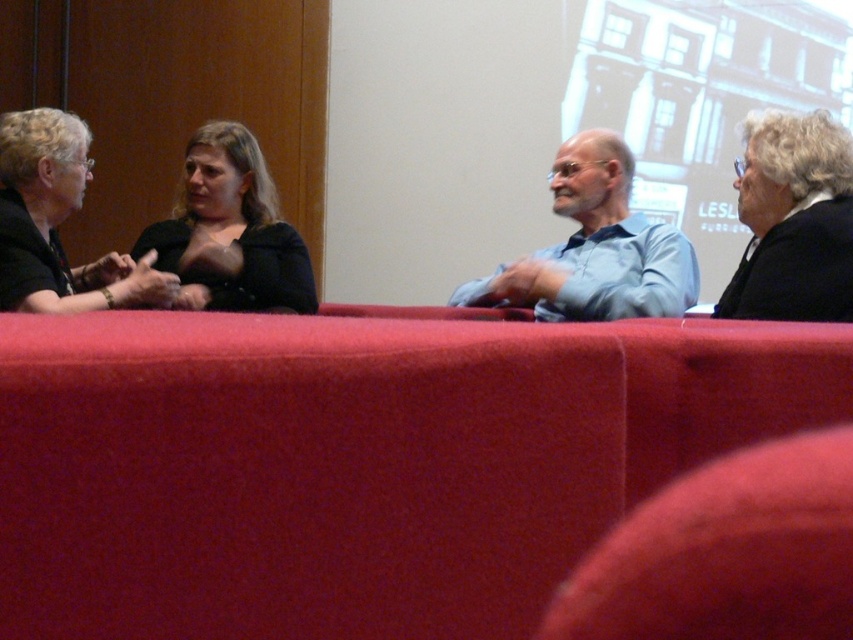
Question: Can you confirm if light blue shirt at center is positioned to the left of matte black jacket at left?

Choices:
 (A) no
 (B) yes

Answer: (A)

Question: Which of the following is the farthest from the observer?

Choices:
 (A) (283, 280)
 (B) (0, 304)
 (C) (753, 304)
 (D) (627, 172)

Answer: (D)

Question: Which of the following is the farthest from the observer?

Choices:
 (A) (798, 182)
 (B) (613, 209)
 (C) (230, 301)
 (D) (24, 173)

Answer: (B)

Question: Is black woolen jacket at right above matte black shirt at center?

Choices:
 (A) no
 (B) yes

Answer: (A)

Question: Does light blue shirt at center have a larger size compared to matte black jacket at left?

Choices:
 (A) yes
 (B) no

Answer: (A)

Question: Among these points, which one is nearest to the camera?

Choices:
 (A) (317, 305)
 (B) (798, 314)

Answer: (B)